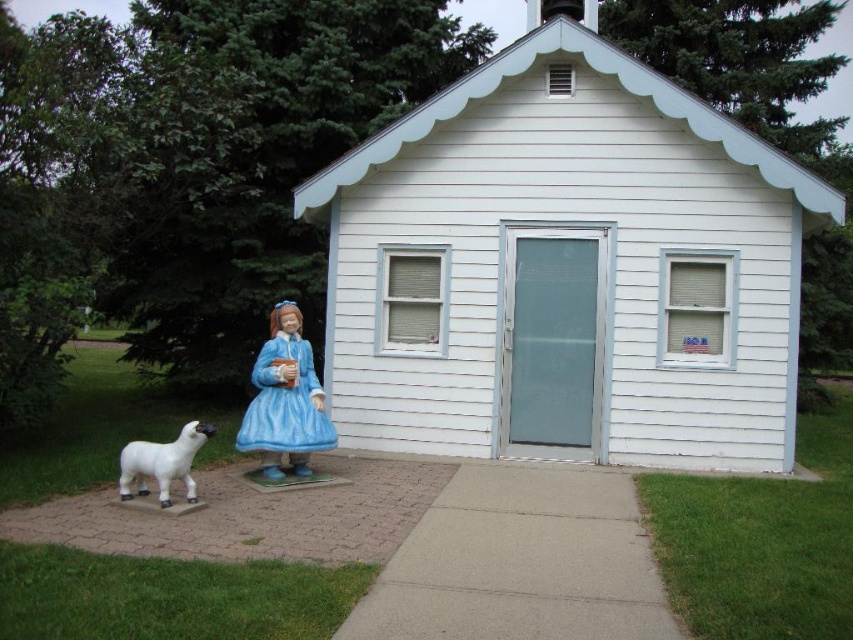
Question: Considering the relative positions of white painted wood chapel at center and white glossy goat at left in the image provided, where is white painted wood chapel at center located with respect to white glossy goat at left?

Choices:
 (A) above
 (B) below

Answer: (A)

Question: In this image, where is white painted wood chapel at center located relative to white glossy goat at left?

Choices:
 (A) left
 (B) right

Answer: (B)

Question: Can you confirm if blue glossy dress at center is wider than white glossy goat at left?

Choices:
 (A) no
 (B) yes

Answer: (A)

Question: Estimate the real-world distances between objects in this image. Which object is closer to the blue glossy dress at center?

Choices:
 (A) white painted wood chapel at center
 (B) white glossy goat at left

Answer: (B)

Question: Which object is closer to the camera taking this photo?

Choices:
 (A) blue glossy dress at center
 (B) white glossy goat at left

Answer: (B)

Question: Which object is farther from the camera taking this photo?

Choices:
 (A) blue glossy dress at center
 (B) white glossy goat at left
 (C) white painted wood chapel at center

Answer: (C)